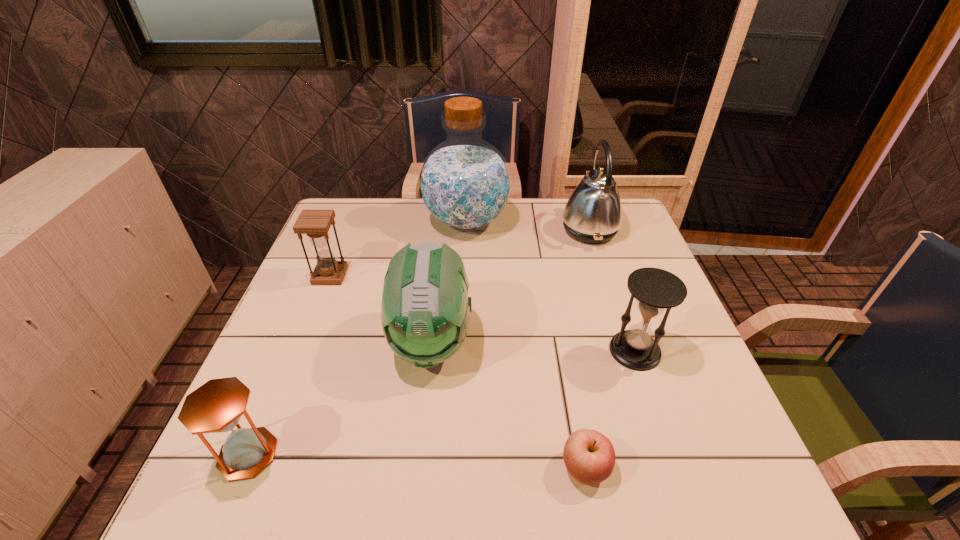
The image size is (960, 540). Find the location of `blank area located from the spout of the sixth shortest object`. blank area located from the spout of the sixth shortest object is located at coordinates (540, 230).

You are a GUI agent. You are given a task and a screenshot of the screen. Output one action in this format:
    pyautogui.click(x=<x>, y=<y>)
    Task: Click on the free location located 0.130m from the spout of the sixth shortest object
    This screenshot has height=540, width=960.
    Given the screenshot: What is the action you would take?
    pyautogui.click(x=518, y=230)

Find the location of a particular element. The image size is (960, 540). free space located 0.180m on the visor of the football helmet is located at coordinates (417, 470).

Where is `vacant space located 0.380m on the back of the second farthest hourglass`? vacant space located 0.380m on the back of the second farthest hourglass is located at coordinates (597, 239).

The height and width of the screenshot is (540, 960). Identify the location of free spot located 0.240m on the back of the farthest hourglass. click(x=352, y=219).

Find the location of a particular element. free location located 0.390m on the right of the nearest hourglass is located at coordinates (484, 454).

You are a GUI agent. You are given a task and a screenshot of the screen. Output one action in this format:
    pyautogui.click(x=<x>, y=<y>)
    Task: Click on the free space located on the right of the apple
    Image resolution: width=960 pixels, height=540 pixels.
    Given the screenshot: What is the action you would take?
    pyautogui.click(x=681, y=468)

The height and width of the screenshot is (540, 960). Find the location of `water jug situated at the far edge`. water jug situated at the far edge is located at coordinates (464, 183).

The image size is (960, 540). What are the coordinates of `kettle that is at the far edge` in the screenshot? It's located at (593, 214).

Find the location of a particular element. hourglass at the near edge is located at coordinates (215, 407).